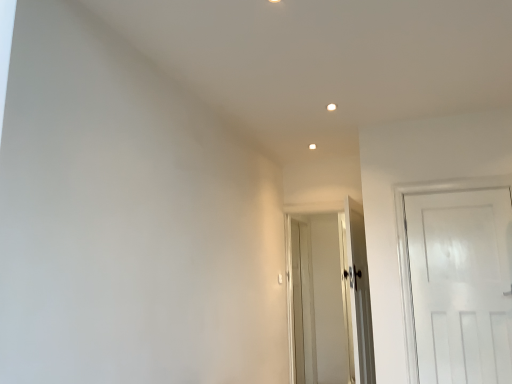
Question: Does white matte door at right, which is counted as the 3th door, starting from the back, turn towards white wooden door at center, which appears as the 1th door when viewed from the back?

Choices:
 (A) no
 (B) yes

Answer: (A)

Question: Is white matte door at right, which is counted as the 3th door, starting from the back, bigger than white wooden door at center, which appears as the 1th door when viewed from the back?

Choices:
 (A) yes
 (B) no

Answer: (B)

Question: Is white matte door at right, the first door when ordered from front to back, further to camera compared to white wooden door at center, which appears as the 1th door when viewed from the back?

Choices:
 (A) no
 (B) yes

Answer: (A)

Question: From the image's perspective, is white matte door at right, the first door when ordered from front to back, beneath white wooden door at center, arranged as the third door when viewed from the front?

Choices:
 (A) yes
 (B) no

Answer: (B)

Question: Does white matte door at right, the first door when ordered from front to back, appear on the left side of white wooden door at center, arranged as the third door when viewed from the front?

Choices:
 (A) no
 (B) yes

Answer: (A)

Question: From a real-world perspective, is white matte door at right, the first door when ordered from front to back, below white wooden door at center, which appears as the 1th door when viewed from the back?

Choices:
 (A) yes
 (B) no

Answer: (B)

Question: Is white glossy door at center, the second door in the back-to-front sequence, not close to white wooden door at center, which appears as the 1th door when viewed from the back?

Choices:
 (A) no
 (B) yes

Answer: (A)

Question: Is white glossy door at center, the second door in the back-to-front sequence, to the left of white wooden door at center, arranged as the third door when viewed from the front, from the viewer's perspective?

Choices:
 (A) no
 (B) yes

Answer: (A)

Question: Is white glossy door at center, the second door in the back-to-front sequence, turned away from white wooden door at center, arranged as the third door when viewed from the front?

Choices:
 (A) no
 (B) yes

Answer: (A)

Question: Is the position of white glossy door at center, which is the second door from front to back, more distant than that of white wooden door at center, arranged as the third door when viewed from the front?

Choices:
 (A) no
 (B) yes

Answer: (A)

Question: Can you confirm if white glossy door at center, the second door in the back-to-front sequence, is taller than white wooden door at center, arranged as the third door when viewed from the front?

Choices:
 (A) no
 (B) yes

Answer: (A)

Question: Considering the relative sizes of white glossy door at center, the second door in the back-to-front sequence, and white wooden door at center, which appears as the 1th door when viewed from the back, in the image provided, is white glossy door at center, the second door in the back-to-front sequence, wider than white wooden door at center, which appears as the 1th door when viewed from the back,?

Choices:
 (A) no
 (B) yes

Answer: (A)